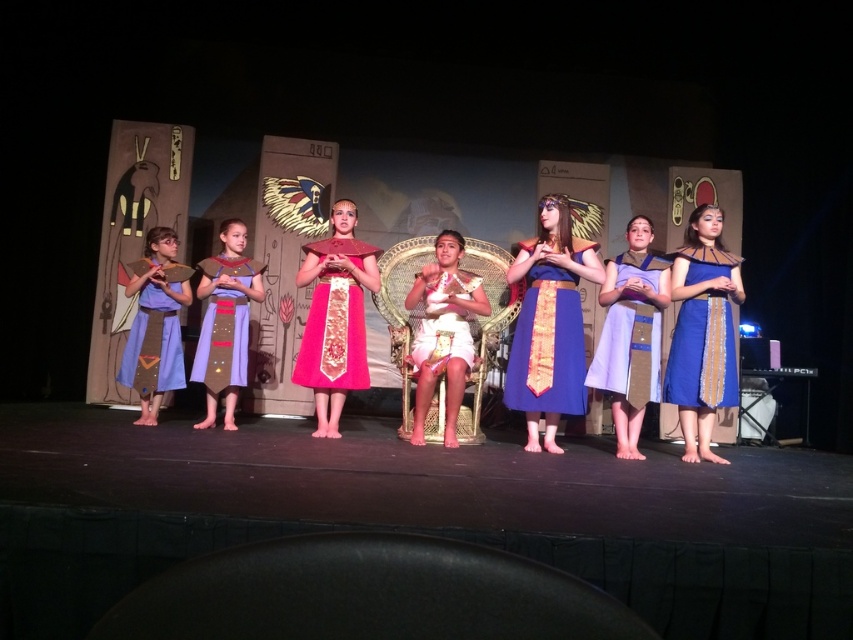
Question: Which object is closer to the camera taking this photo?

Choices:
 (A) matte blue dress at center
 (B) white silk dress at center

Answer: (A)

Question: Which object is the farthest from the matte blue fabric dress at left?

Choices:
 (A) blue satin dress at right
 (B) matte blue dress at center

Answer: (A)

Question: Does shiny red fabric dress at center have a larger size compared to matte purple fabric dress at center?

Choices:
 (A) no
 (B) yes

Answer: (B)

Question: Which object is the closest to the shiny red fabric dress at center?

Choices:
 (A) matte purple fabric dress at center
 (B) blue satin dress at center
 (C) matte blue dress at center

Answer: (A)

Question: Does white silk dress at center appear on the left side of shiny red fabric dress at center?

Choices:
 (A) yes
 (B) no

Answer: (B)

Question: Considering the relative positions of blue satin dress at right and matte blue dress at center in the image provided, where is blue satin dress at right located with respect to matte blue dress at center?

Choices:
 (A) below
 (B) above

Answer: (A)